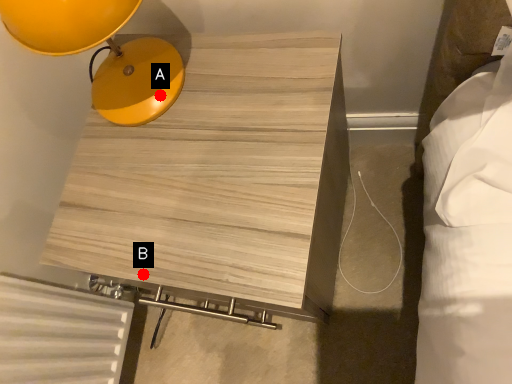
Question: Two points are circled on the image, labeled by A and B beside each circle. Which point appears closest to the camera in this image?

Choices:
 (A) A is closer
 (B) B is closer

Answer: (B)